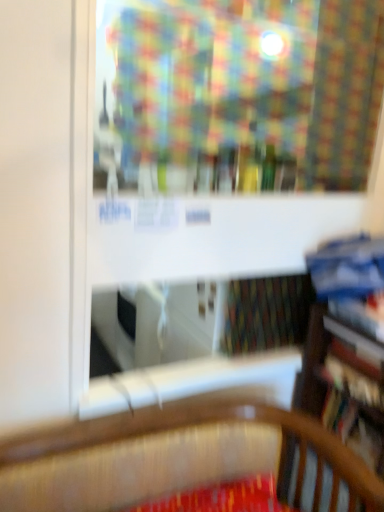
Question: From the image's perspective, would you say hardcover book at right, the 2th book from the bottom, is positioned over hardcover book at right, which is counted as the 4th book, starting from the top?

Choices:
 (A) no
 (B) yes

Answer: (B)

Question: From a real-world perspective, is hardcover book at right, marked as the third book in a top-to-bottom arrangement, beneath hardcover book at right, marked as the first book in a bottom-to-top arrangement?

Choices:
 (A) yes
 (B) no

Answer: (B)

Question: From the image's perspective, does hardcover book at right, the 2th book from the bottom, appear lower than hardcover book at right, marked as the first book in a bottom-to-top arrangement?

Choices:
 (A) no
 (B) yes

Answer: (A)

Question: Considering the relative sizes of hardcover book at right, the 2th book from the bottom, and hardcover book at right, marked as the first book in a bottom-to-top arrangement, in the image provided, is hardcover book at right, the 2th book from the bottom, bigger than hardcover book at right, marked as the first book in a bottom-to-top arrangement,?

Choices:
 (A) no
 (B) yes

Answer: (A)

Question: Is hardcover book at right, marked as the third book in a top-to-bottom arrangement, wider than hardcover book at right, marked as the first book in a bottom-to-top arrangement?

Choices:
 (A) no
 (B) yes

Answer: (A)

Question: Would you say blue hardcover book at right, the 1th book from the top, is inside or outside hardcover book at right, which is counted as the third book, starting from the bottom?

Choices:
 (A) outside
 (B) inside

Answer: (A)

Question: Is point (342, 292) closer or farther from the camera than point (365, 329)?

Choices:
 (A) farther
 (B) closer

Answer: (A)

Question: Is blue hardcover book at right, the 1th book from the top, taller or shorter than hardcover book at right, which is counted as the third book, starting from the bottom?

Choices:
 (A) tall
 (B) short

Answer: (A)

Question: From a real-world perspective, is blue hardcover book at right, the 1th book from the top, above or below hardcover book at right, which is counted as the third book, starting from the bottom?

Choices:
 (A) above
 (B) below

Answer: (A)

Question: Considering the positions of hardcover book at right, the 2th book from the bottom, and blue hardcover book at right, which is counted as the 4th book, starting from the bottom, in the image, is hardcover book at right, the 2th book from the bottom, bigger or smaller than blue hardcover book at right, which is counted as the 4th book, starting from the bottom,?

Choices:
 (A) small
 (B) big

Answer: (A)

Question: Would you say hardcover book at right, marked as the third book in a top-to-bottom arrangement, is inside or outside blue hardcover book at right, the 1th book from the top?

Choices:
 (A) inside
 (B) outside

Answer: (B)

Question: Relative to blue hardcover book at right, the 1th book from the top, is hardcover book at right, marked as the third book in a top-to-bottom arrangement, in front or behind?

Choices:
 (A) front
 (B) behind

Answer: (B)

Question: From the image's perspective, is hardcover book at right, marked as the third book in a top-to-bottom arrangement, positioned above or below blue hardcover book at right, the 1th book from the top?

Choices:
 (A) above
 (B) below

Answer: (B)

Question: Do you think hardcover book at right, which is counted as the third book, starting from the bottom, is within hardcover book at right, the 2th book from the bottom, or outside of it?

Choices:
 (A) inside
 (B) outside

Answer: (B)

Question: From the image's perspective, is hardcover book at right, which is counted as the third book, starting from the bottom, above or below hardcover book at right, marked as the third book in a top-to-bottom arrangement?

Choices:
 (A) below
 (B) above

Answer: (B)